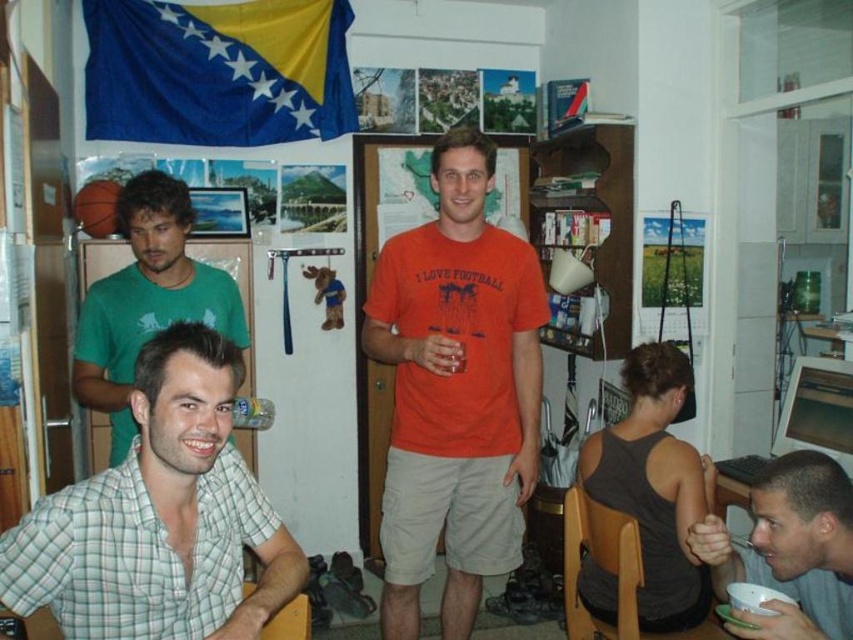
What object is located at the coordinates point (790, 548)?

The point (790, 548) is on the smooth gray bowl at lower right.